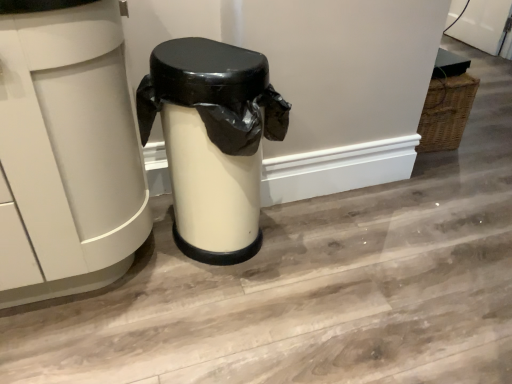
The width and height of the screenshot is (512, 384). Identify the location of free spot in front of matte white trash can at center, the 2th waste container when ordered from left to right. (222, 328).